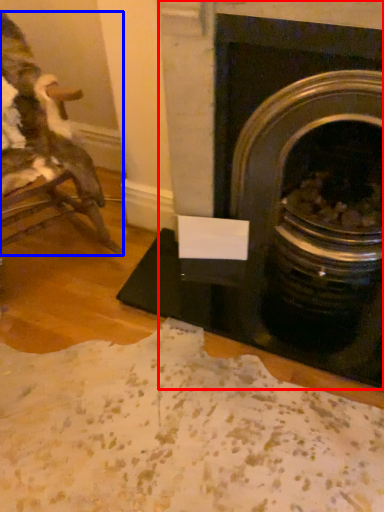
Question: Which object is closer to the camera taking this photo, fireplace (highlighted by a red box) or chair (highlighted by a blue box)?

Choices:
 (A) fireplace
 (B) chair

Answer: (B)